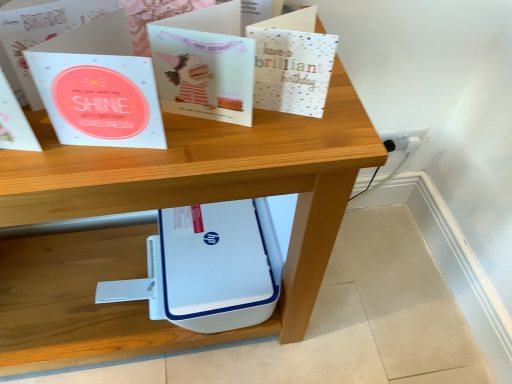
Locate an element on the screen. Image resolution: width=512 pixels, height=384 pixels. free location to the right of matte paper card at center, which ranks as the 2th paperback book in right-to-left order is located at coordinates (318, 128).